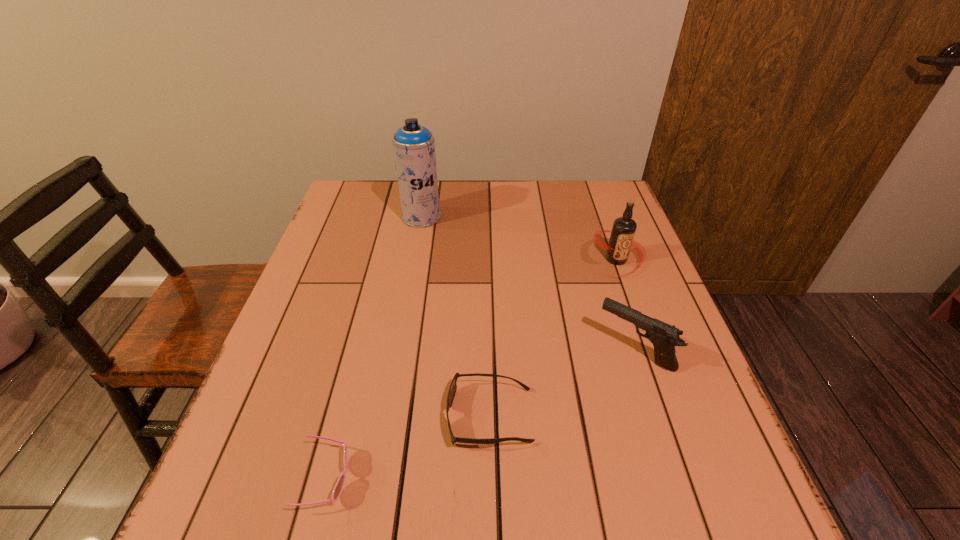
In order to click on the farthest object in this screenshot , I will do `click(413, 144)`.

Image resolution: width=960 pixels, height=540 pixels. In order to click on aerosol can in this screenshot , I will do `click(413, 144)`.

At what (x,y) coordinates should I click in order to perform the action: click on the fourth shortest object. Please return your answer as a coordinate pair (x, y). The height and width of the screenshot is (540, 960). Looking at the image, I should click on (624, 228).

You are a GUI agent. You are given a task and a screenshot of the screen. Output one action in this format:
    pyautogui.click(x=<x>, y=<y>)
    Task: Click on the root beer
    The height and width of the screenshot is (540, 960).
    Given the screenshot: What is the action you would take?
    pyautogui.click(x=624, y=228)

You are a GUI agent. You are given a task and a screenshot of the screen. Output one action in this format:
    pyautogui.click(x=<x>, y=<y>)
    Task: Click on the gun
    This screenshot has width=960, height=540.
    Given the screenshot: What is the action you would take?
    pyautogui.click(x=664, y=337)

Locate an element on the screen. Image resolution: width=960 pixels, height=540 pixels. the third nearest object is located at coordinates (664, 337).

At what (x,y) coordinates should I click in order to perform the action: click on the right sunglasses. Please return your answer as a coordinate pair (x, y). This screenshot has height=540, width=960. Looking at the image, I should click on (453, 387).

Identify the location of the left sunglasses. This screenshot has width=960, height=540. (338, 488).

Find the location of `free location located 0.080m on the back of the aerosol can`. free location located 0.080m on the back of the aerosol can is located at coordinates (425, 193).

This screenshot has height=540, width=960. I want to click on free space located on the label of the second farthest object, so click(x=644, y=337).